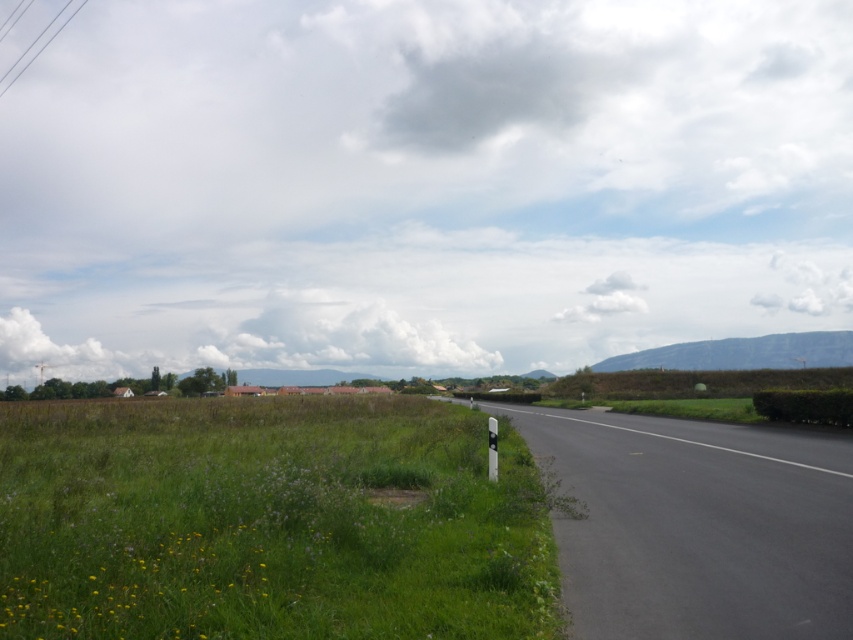
You are a cyclist planning to ride along the black asphalt road at center. You notice the green leafy hedge at right nearby. Considering their sizes, which one would be more noticeable to someone passing by?

The black asphalt road at center is larger in size than the green leafy hedge at right, so the black asphalt road at center would be more noticeable to someone passing by.

You are driving a car that is 18 feet long. You see the black asphalt road at center and the white plastic sign at right. Can your car fit entirely between them without crossing either?

The distance between the black asphalt road at center and the white plastic sign at right is 19.02 feet. Since your car is 18 feet long, it can fit entirely between them without crossing either.

You are a hiker who wants to place a small tent on the green grass at lower left. However, you notice the white plastic sign at right nearby. Can you set up the tent without it being too close to the sign?

The green grass at lower left is to the left of the white plastic sign at right, so you can set up the tent on the green grass at lower left without it being too close to the sign.